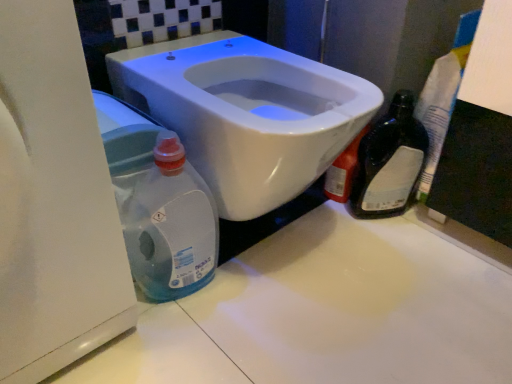
Image resolution: width=512 pixels, height=384 pixels. Find the location of `spots to the right of translucent plastic bottle at lower left`. spots to the right of translucent plastic bottle at lower left is located at coordinates (267, 291).